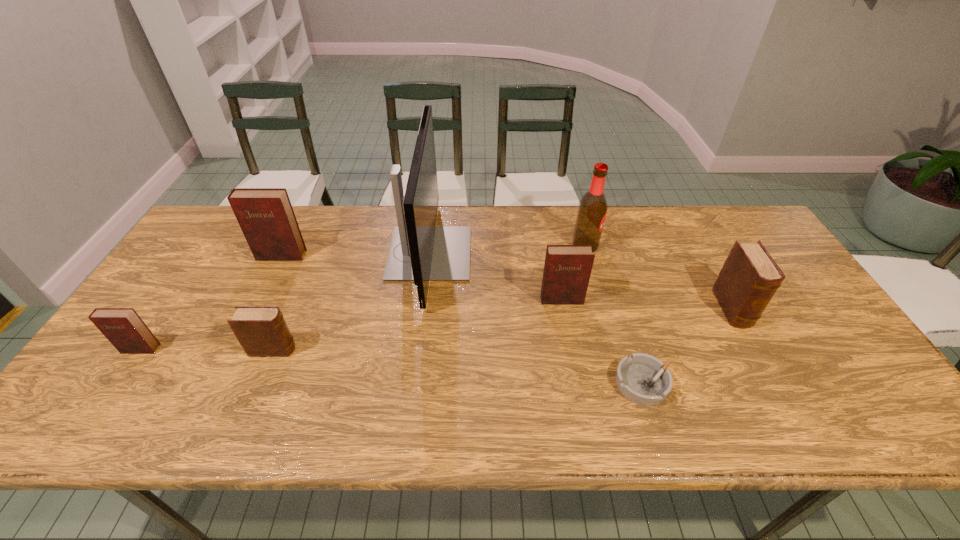
At what (x,y) coordinates should I click in order to perform the action: click on blank area at the right edge. Please return your answer as a coordinate pair (x, y). Looking at the image, I should click on (803, 295).

Where is `vacant space at the far left corner`? vacant space at the far left corner is located at coordinates (228, 237).

Where is `vacant space that's between the nearest reddish-brown diary and the shortest object`? This screenshot has height=540, width=960. vacant space that's between the nearest reddish-brown diary and the shortest object is located at coordinates (392, 366).

What are the coordinates of `unoccupied area between the farthest diary and the leftmost object` in the screenshot? It's located at (211, 302).

Identify the location of free space between the leftmost object and the rightmost object. This screenshot has width=960, height=540. (437, 329).

The height and width of the screenshot is (540, 960). Identify the location of vacant space in between the beer bottle and the leftmost object. (363, 298).

This screenshot has height=540, width=960. Identify the location of free space between the beer bottle and the computer monitor. (508, 249).

Where is `vacant area that lies between the nearer brown diary and the beer bottle`? vacant area that lies between the nearer brown diary and the beer bottle is located at coordinates (429, 298).

Find the location of `empty space that is in between the shortest object and the second tallest object`. empty space that is in between the shortest object and the second tallest object is located at coordinates (613, 314).

This screenshot has height=540, width=960. In order to click on vacant space that is in between the rightmost reddish-brown diary and the leftmost diary in this screenshot , I will do `click(351, 325)`.